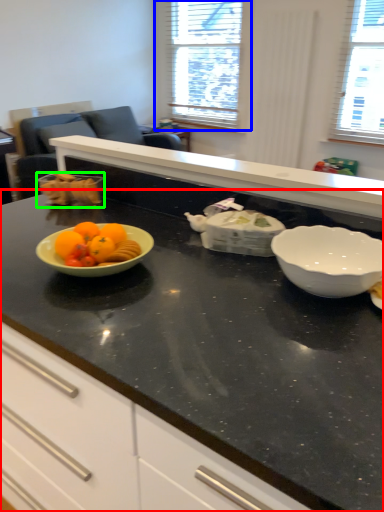
Question: Which is nearer to the countertop (highlighted by a red box)? window (highlighted by a blue box) or tableware (highlighted by a green box).

Choices:
 (A) window
 (B) tableware

Answer: (B)